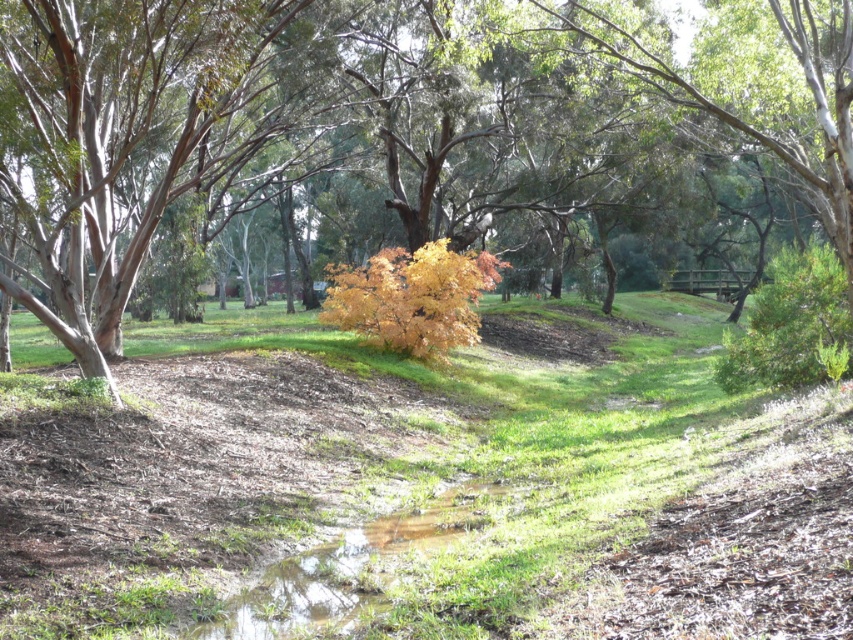
You are standing at the point closest to the camera in the image. There are two points marked in the scene, one at coordinates point (363, 80) and the other at point (350, 595). Which point is farther away from your current position?

Point (363, 80) is behind point (350, 595), so the point farther away from your current position is point (363, 80).

You are standing at the edge of the green grassy puddle at lower center and want to take a photo of the yellow leafy tree at center. In which direction should you move to get the tree in your camera view?

You should move to the right to get the yellow leafy tree at center in your camera view because the yellow leafy tree at center is to the left of the green grassy puddle at lower center, so moving right from the puddle will align the tree in your view.

You are standing at the point marked by coordinates (434,481) in the image. What object is exactly at your current location?

The yellow leafy tree at center is located at point (434,481), so the object at your current location is the yellow leafy tree at center.